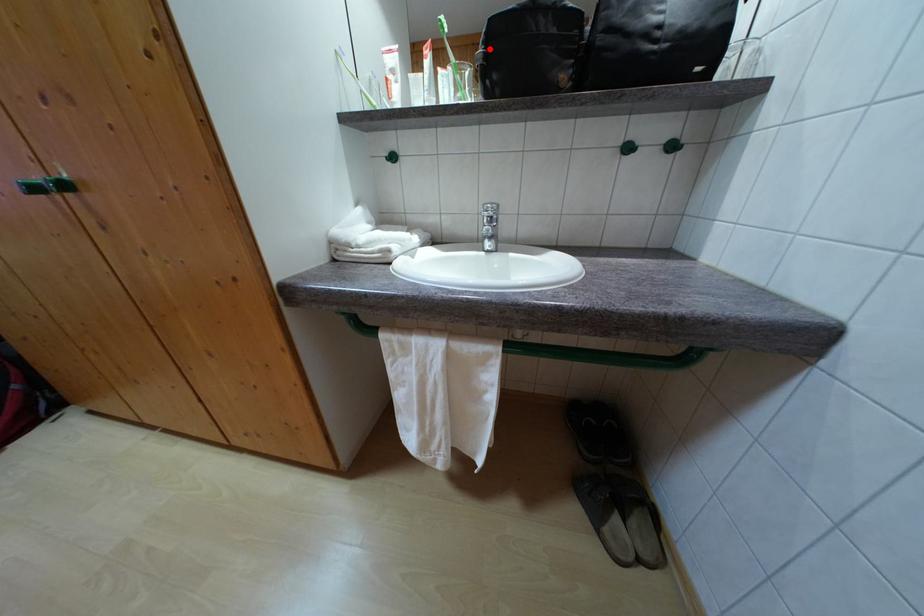
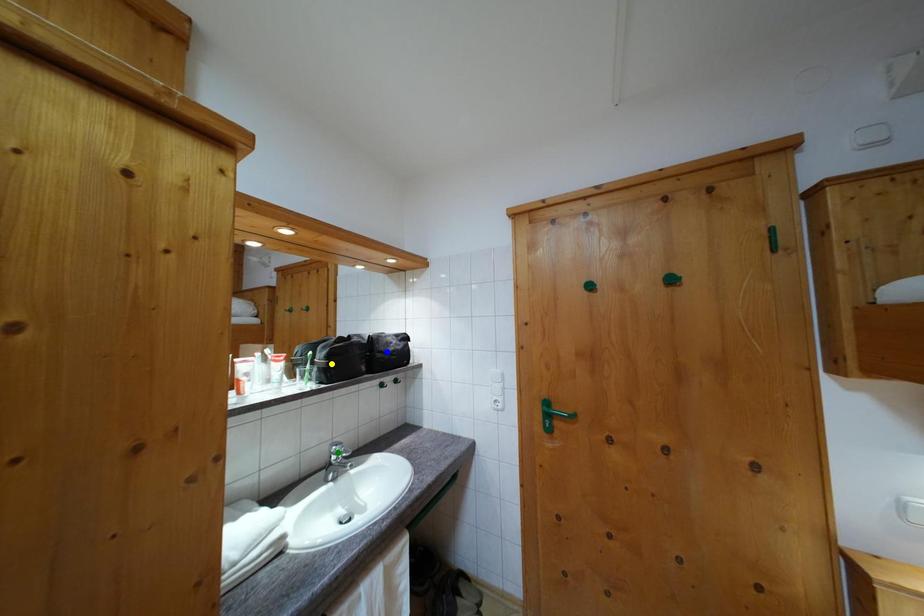
Question: I am providing you with two images of the same scene from different viewpoints. A red point is marked on the first image. You are given multiple points on the second image. Which spot in image 2 lines up with the point in image 1?

Choices:
 (A) blue point
 (B) yellow point
 (C) green point

Answer: (B)